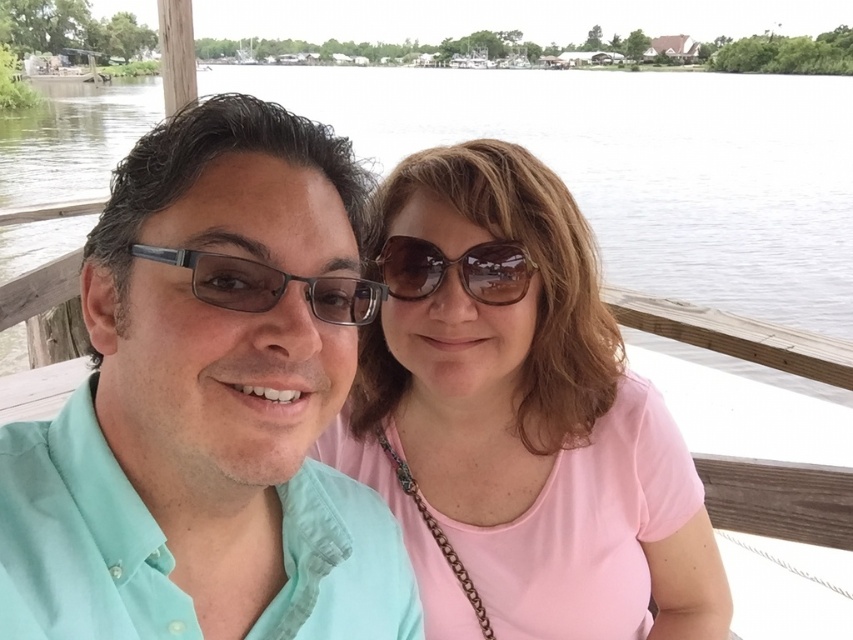
Looking at this image, which is more to the left, pink fabric shirt at center or transparent water at center?

transparent water at center is more to the left.

At what (x,y) coordinates should I click in order to perform the action: click on pink fabric shirt at center. Please return your answer as a coordinate pair (x, y). Looking at the image, I should click on (518, 417).

You are a GUI agent. You are given a task and a screenshot of the screen. Output one action in this format:
    pyautogui.click(x=<x>, y=<y>)
    Task: Click on the pink fabric shirt at center
    
    Given the screenshot: What is the action you would take?
    pyautogui.click(x=518, y=417)

Is matte teal shirt at left positioned behind pink fabric shirt at center?

No, it is in front of pink fabric shirt at center.

Is point (142, 504) in front of point (573, 492)?

Yes.

Is point (265, 541) positioned before point (375, 337)?

Yes, it is in front of point (375, 337).

Where is `matte teal shirt at left`? The width and height of the screenshot is (853, 640). matte teal shirt at left is located at coordinates (209, 404).

Is matte teal shirt at left positioned at the back of brown matte sunglasses at center?

No, matte teal shirt at left is closer to the viewer.

Between matte teal shirt at left and brown matte sunglasses at center, which one has more height?

matte teal shirt at left is taller.

Is point (241, 326) closer to camera compared to point (386, 278)?

Yes, point (241, 326) is in front of point (386, 278).

Where is `matte teal shirt at left`? matte teal shirt at left is located at coordinates coord(209,404).